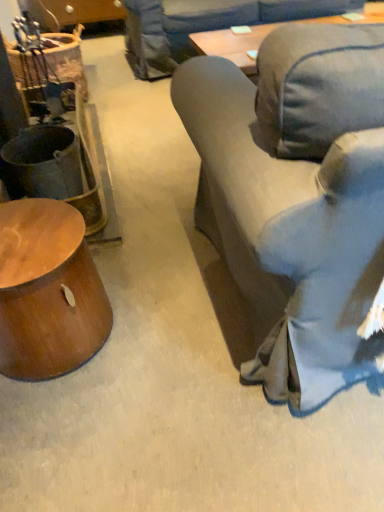
Question: Is shiny brown wood side table at lower left oriented away from denim fabric couch at right?

Choices:
 (A) no
 (B) yes

Answer: (A)

Question: Considering the relative positions of shiny brown wood side table at lower left and denim fabric couch at right in the image provided, is shiny brown wood side table at lower left to the right of denim fabric couch at right from the viewer's perspective?

Choices:
 (A) no
 (B) yes

Answer: (A)

Question: Is denim fabric couch at right surrounded by shiny brown wood side table at lower left?

Choices:
 (A) no
 (B) yes

Answer: (A)

Question: From a real-world perspective, does shiny brown wood side table at lower left sit lower than denim fabric couch at right?

Choices:
 (A) no
 (B) yes

Answer: (B)

Question: From the image's perspective, is shiny brown wood side table at lower left over denim fabric couch at right?

Choices:
 (A) yes
 (B) no

Answer: (B)

Question: Considering the relative sizes of shiny brown wood side table at lower left and denim fabric couch at right in the image provided, is shiny brown wood side table at lower left thinner than denim fabric couch at right?

Choices:
 (A) yes
 (B) no

Answer: (A)

Question: From the image's perspective, is denim fabric couch at right over shiny brown wood side table at lower left?

Choices:
 (A) no
 (B) yes

Answer: (B)

Question: Is denim fabric couch at right far away from shiny brown wood side table at lower left?

Choices:
 (A) yes
 (B) no

Answer: (B)

Question: Does denim fabric couch at right have a lesser height compared to shiny brown wood side table at lower left?

Choices:
 (A) yes
 (B) no

Answer: (B)

Question: From the image's perspective, is denim fabric couch at right under shiny brown wood side table at lower left?

Choices:
 (A) no
 (B) yes

Answer: (A)

Question: From a real-world perspective, does denim fabric couch at right sit lower than shiny brown wood side table at lower left?

Choices:
 (A) yes
 (B) no

Answer: (B)

Question: Considering the relative sizes of denim fabric couch at right and shiny brown wood side table at lower left in the image provided, is denim fabric couch at right wider than shiny brown wood side table at lower left?

Choices:
 (A) yes
 (B) no

Answer: (A)

Question: From their relative heights in the image, would you say shiny brown wood side table at lower left is taller or shorter than denim fabric couch at right?

Choices:
 (A) short
 (B) tall

Answer: (A)